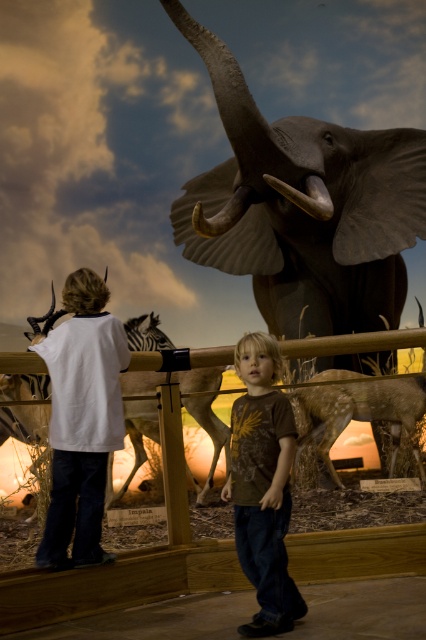
Is gray matte elephant at upper center below matte ivory tusk at upper center?

No, gray matte elephant at upper center is not below matte ivory tusk at upper center.

Consider the image. Does gray matte elephant at upper center appear on the right side of matte ivory tusk at upper center?

In fact, gray matte elephant at upper center is to the left of matte ivory tusk at upper center.

Between point (317, 173) and point (281, 188), which one is positioned behind?

The point (317, 173) is more distant.

This screenshot has width=426, height=640. What are the coordinates of `gray matte elephant at upper center` in the screenshot? It's located at (302, 209).

Which is below, gray matte elephant at upper center or brown cotton shirt at center?

brown cotton shirt at center is below.

Where is `gray matte elephant at upper center`? gray matte elephant at upper center is located at coordinates (302, 209).

Is point (334, 323) farther from viewer compared to point (275, 596)?

Yes, point (334, 323) is farther from viewer.

Locate an element on the screen. gray matte elephant at upper center is located at coordinates 302,209.

Which is more to the left, brown cotton shirt at center or matte ivory tusk at upper center?

brown cotton shirt at center

Between brown cotton shirt at center and matte ivory tusk at upper center, which one has less height?

Standing shorter between the two is matte ivory tusk at upper center.

This screenshot has width=426, height=640. What do you see at coordinates (262, 484) in the screenshot? I see `brown cotton shirt at center` at bounding box center [262, 484].

Locate an element on the screen. The image size is (426, 640). brown cotton shirt at center is located at coordinates (262, 484).